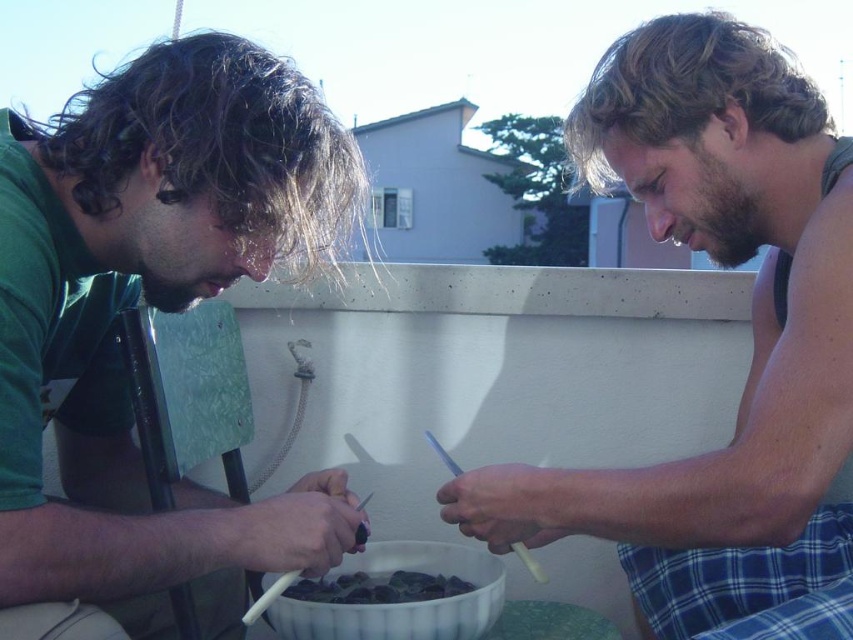
In the scene shown: Does green matte shirt at left have a smaller size compared to smooth skin man at center?

Correct, green matte shirt at left occupies less space than smooth skin man at center.

Based on the photo, measure the distance between green matte shirt at left and camera.

green matte shirt at left is 67.72 centimeters away from camera.

Where is `green matte shirt at left`? This screenshot has height=640, width=853. green matte shirt at left is located at coordinates (158, 308).

Who is lower down, green matte shirt at left or dark green glossy shells at center?

dark green glossy shells at center is lower down.

This screenshot has height=640, width=853. Describe the element at coordinates (158, 308) in the screenshot. I see `green matte shirt at left` at that location.

Where is `green matte shirt at left`? green matte shirt at left is located at coordinates (158, 308).

Which is behind, point (672, 113) or point (329, 580)?

Positioned behind is point (329, 580).

Based on the photo, which is more to the right, smooth skin man at center or dark green glossy shells at center?

smooth skin man at center

Does point (798, 336) come behind point (432, 588)?

No, it is not.

At what (x,y) coordinates should I click in order to perform the action: click on smooth skin man at center. Please return your answer as a coordinate pair (x, y). This screenshot has width=853, height=640. Looking at the image, I should click on (752, 339).